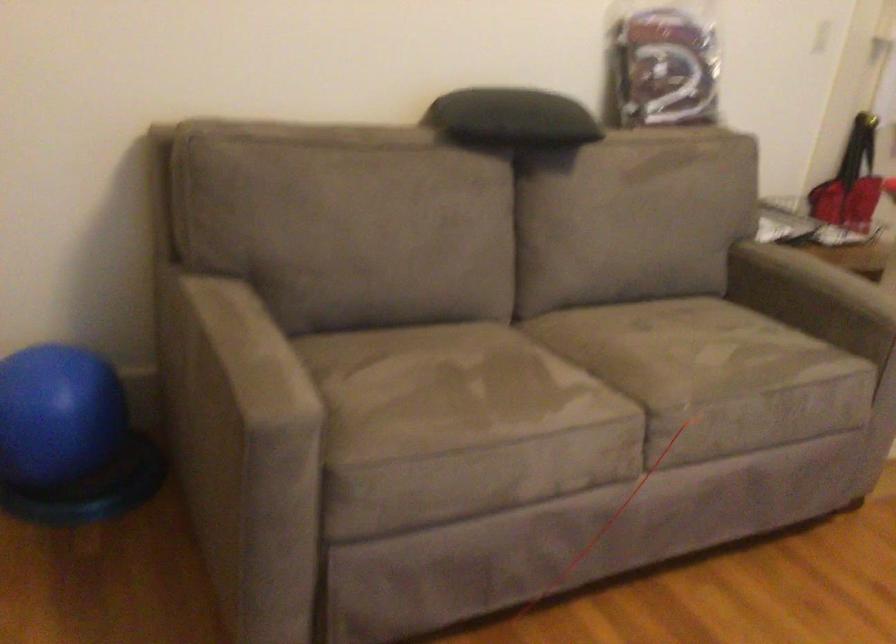
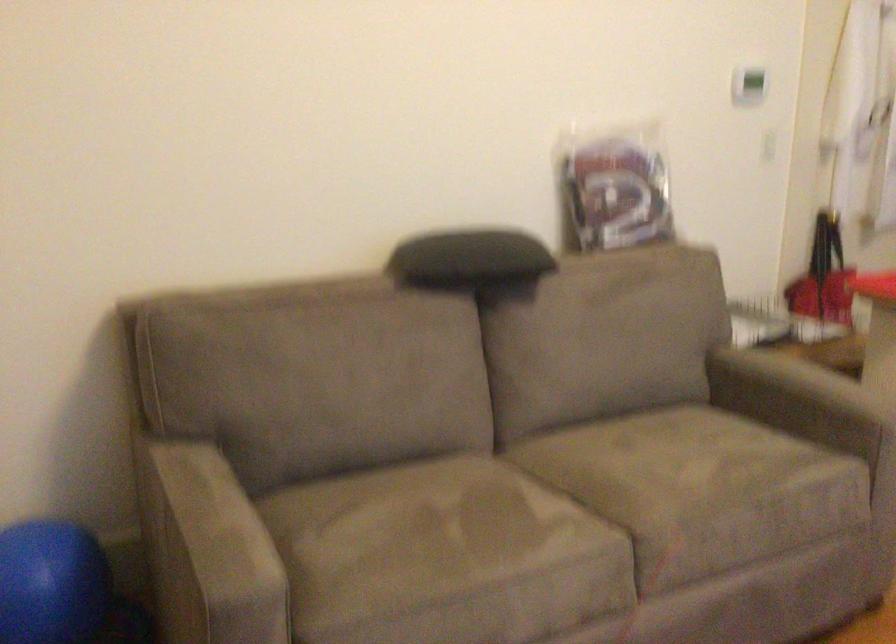
Locate, in the second image, the point that corresponds to [470,406] in the first image.

(444, 556)